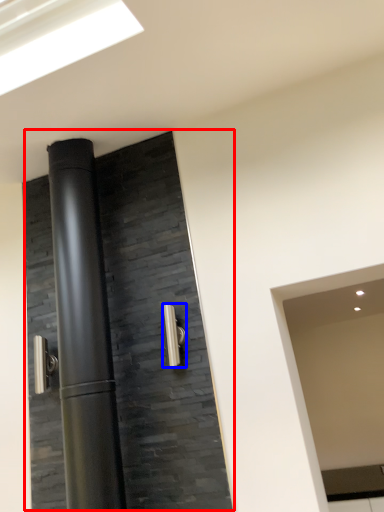
Question: Which of the following is the closest to the observer, door (highlighted by a red box) or door handle (highlighted by a blue box)?

Choices:
 (A) door
 (B) door handle

Answer: (A)